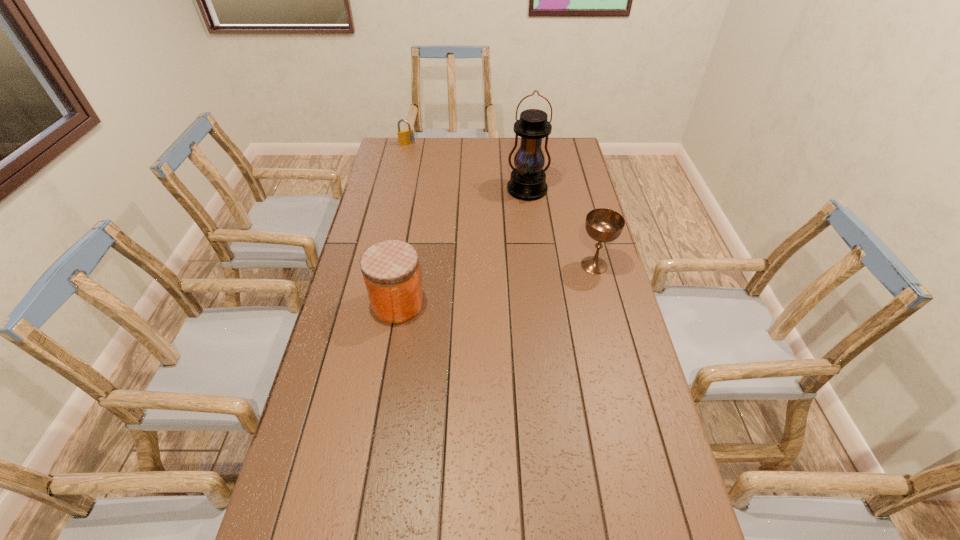
At what (x,y) coordinates should I click in order to perform the action: click on vacant spot on the desktop that is between the nearest object and the chalice and is positioned above the lantern, indicating its light source. Please return your answer as a coordinate pair (x, y). Looking at the image, I should click on (521, 280).

The image size is (960, 540). Find the location of `vacant space on the desktop that is between the jar and the rightmost object and is positioned on the side with the combination dials of the farthest object`. vacant space on the desktop that is between the jar and the rightmost object and is positioned on the side with the combination dials of the farthest object is located at coordinates (485, 287).